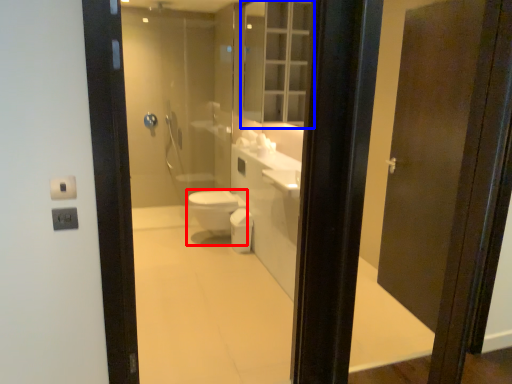
Question: Which object is closer to the camera taking this photo, bidet (highlighted by a red box) or medicine cabinet (highlighted by a blue box)?

Choices:
 (A) bidet
 (B) medicine cabinet

Answer: (B)